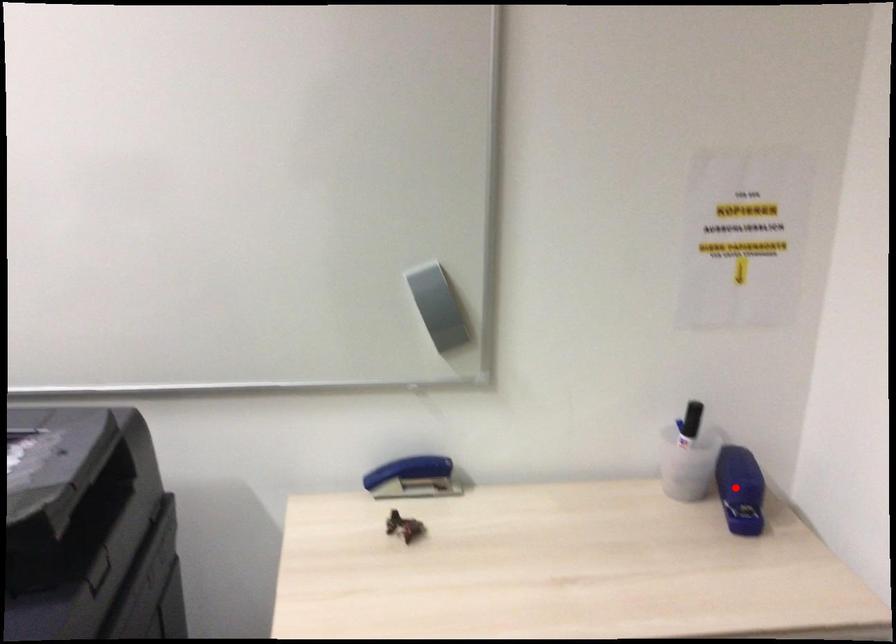
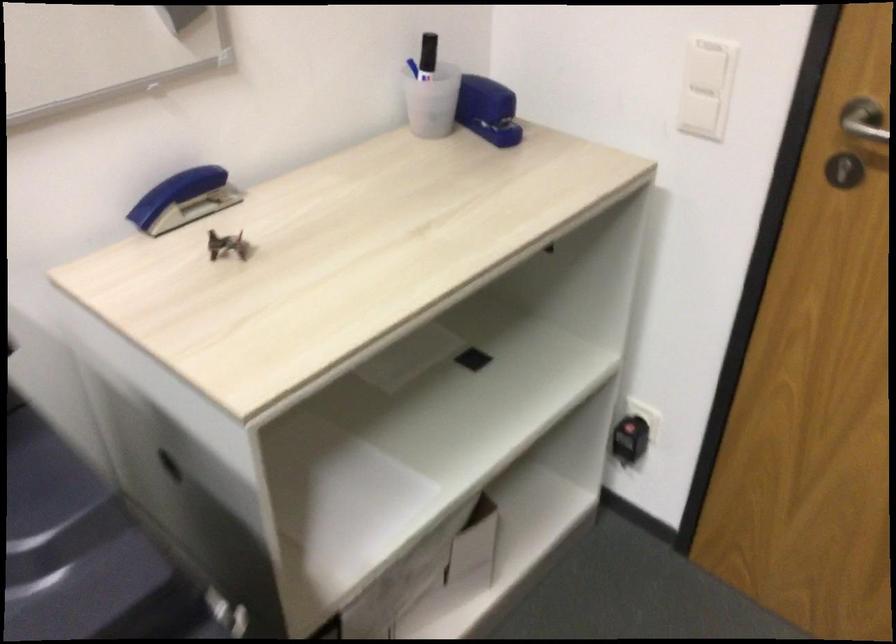
The point at the highlighted location is marked in the first image. Where is the corresponding point in the second image?

(487, 109)